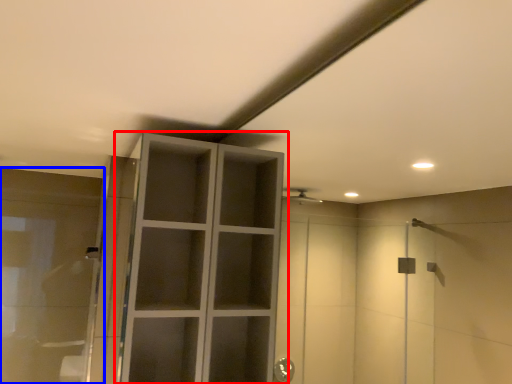
Question: Which object appears closest to the camera in this image, cupboard (highlighted by a red box) or cabinetry (highlighted by a blue box)?

Choices:
 (A) cupboard
 (B) cabinetry

Answer: (A)